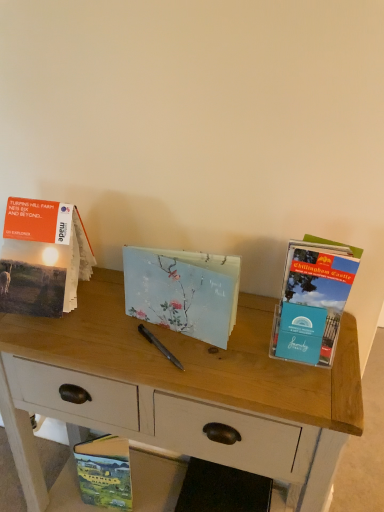
In order to click on free area in between light blue textured notebook at center, marked as the third book in a left-to-right arrangement, and matte paper book at left, which appears as the fourth book when ordered from the bottom in this screenshot , I will do `click(119, 324)`.